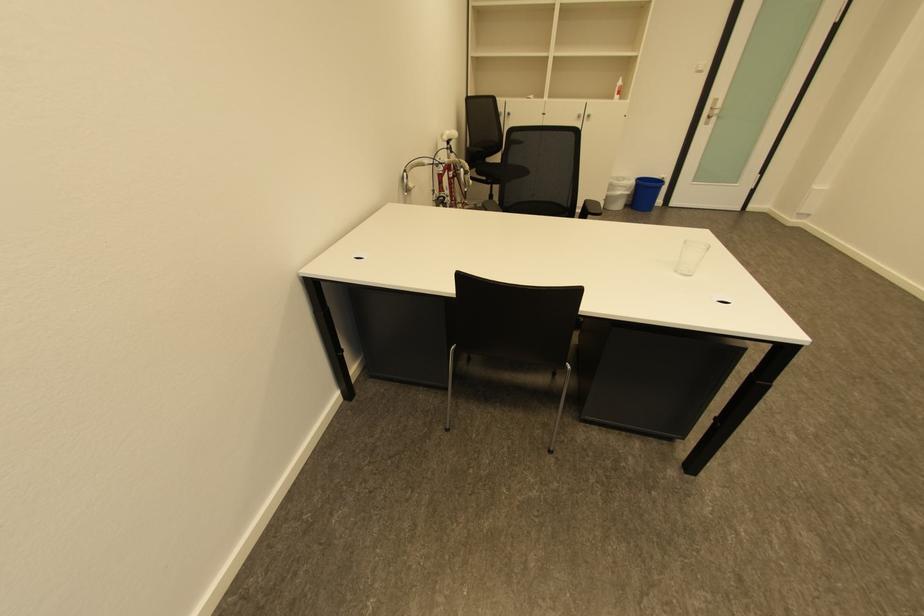
Locate an element on the screen. silver door handle is located at coordinates (713, 114).